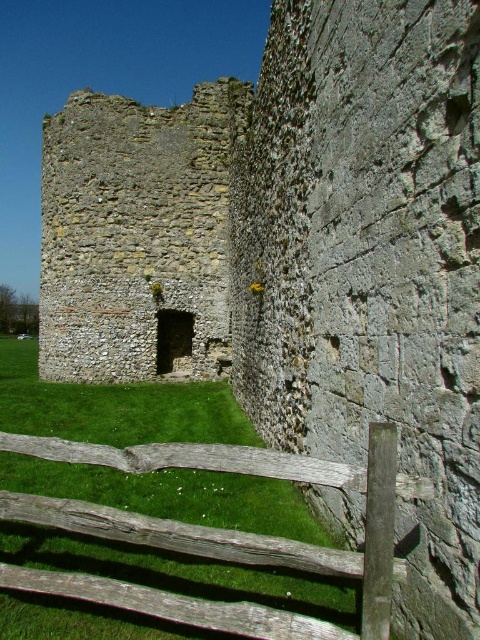
Is rusty stone ruins at center further to camera compared to weathered wood fence at lower center?

Yes.

Who is more forward, (171, 205) or (383, 582)?

Point (383, 582)

The image size is (480, 640). What are the coordinates of `rusty stone ruins at center` in the screenshot? It's located at (137, 236).